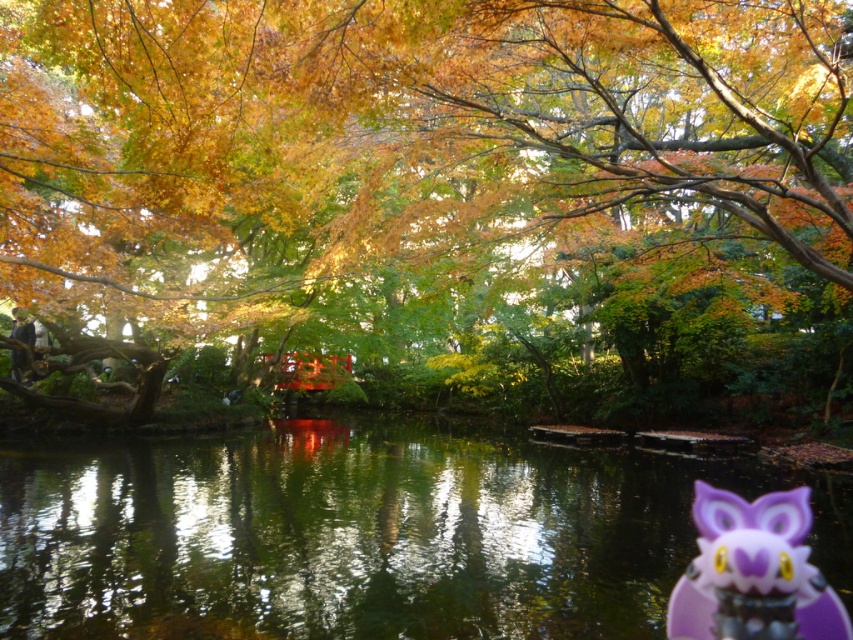
Who is lower down, green reflective water at center or purple plastic owl at lower right?

green reflective water at center

How distant is green reflective water at center from purple plastic owl at lower right?

A distance of 7.82 meters exists between green reflective water at center and purple plastic owl at lower right.

This screenshot has height=640, width=853. What do you see at coordinates (363, 534) in the screenshot? I see `green reflective water at center` at bounding box center [363, 534].

The image size is (853, 640). Find the location of `green reflective water at center`. green reflective water at center is located at coordinates (363, 534).